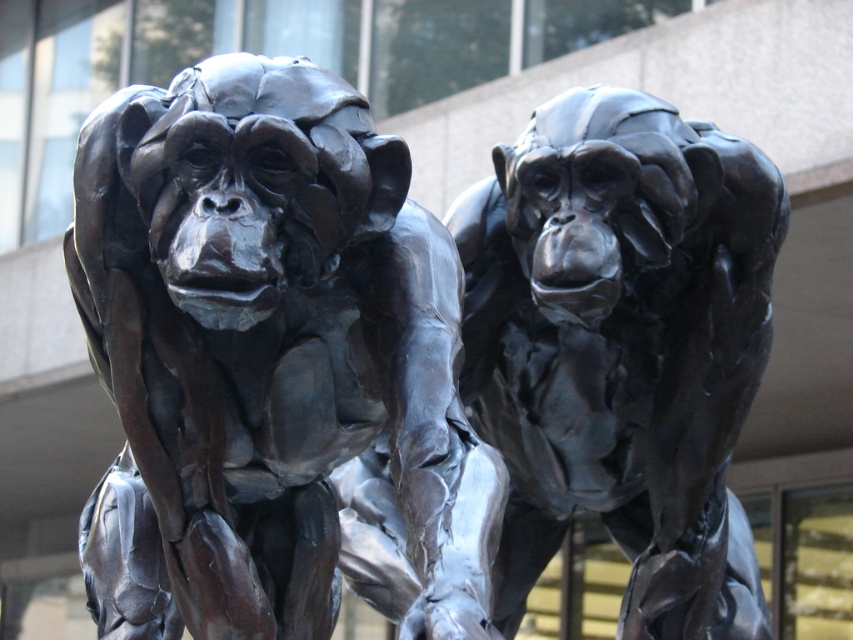
Who is more distant from viewer, (416, 368) or (521, 509)?

The point (521, 509) is behind.

Can you confirm if bronze statue at center is positioned above polished bronze monkey at center?

No, bronze statue at center is not above polished bronze monkey at center.

This screenshot has width=853, height=640. What do you see at coordinates (267, 356) in the screenshot?
I see `bronze statue at center` at bounding box center [267, 356].

Find the location of a particular element. bronze statue at center is located at coordinates (267, 356).